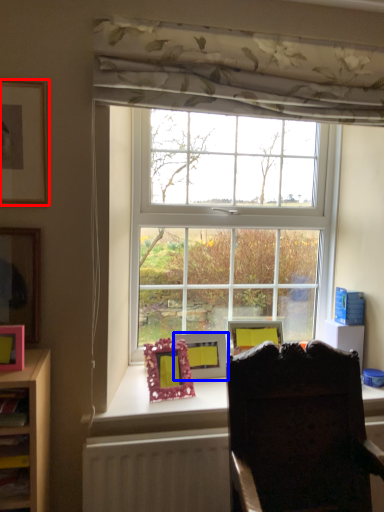
Question: Among these objects, which one is nearest to the camera, picture frame (highlighted by a red box) or picture frame (highlighted by a blue box)?

Choices:
 (A) picture frame
 (B) picture frame

Answer: (A)